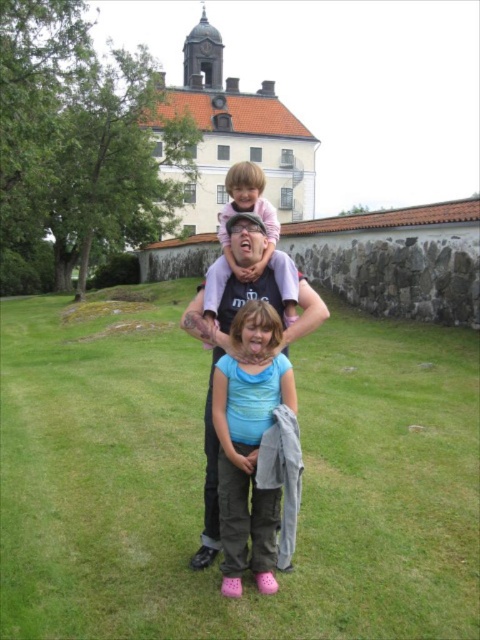
You are standing on the grassy lawn in front of the historic building. There is a point marked at coordinates (203,476). What is located at that point?

The point at coordinates (203,476) marks green grass at center.

You are standing in front of the historic building and notice a green grass at center and a matte blue shirt at center. Which object is located above the other?

The green grass at center is positioned over matte blue shirt at center, meaning it is above the matte blue shirt at center.